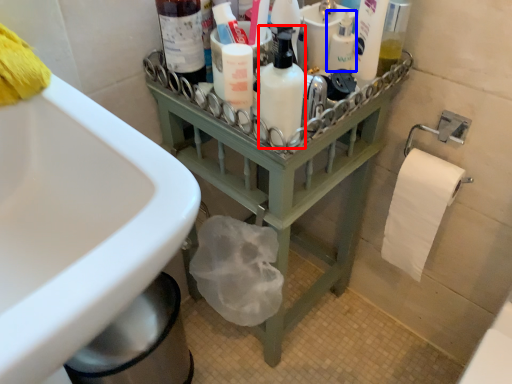
Question: Which object appears closest to the camera in this image, cleaning product (highlighted by a red box) or mouthwash (highlighted by a blue box)?

Choices:
 (A) cleaning product
 (B) mouthwash

Answer: (A)